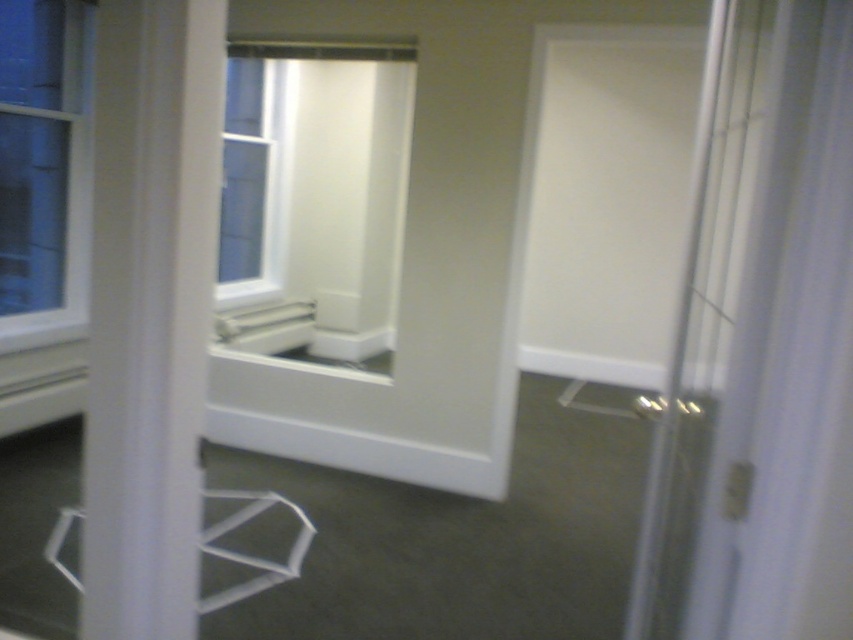
You are standing outside the room looking through the partially open door. You see a white glossy window at center and a clear glass window at center. Which window is closer to you?

The white glossy window at center is closer to you because it is in front of the clear glass window at center.